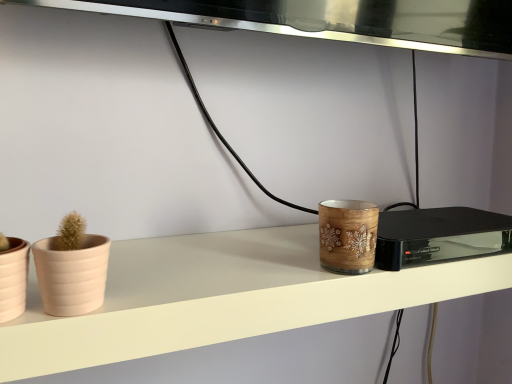
This screenshot has width=512, height=384. I want to click on free space behind wooden candle holder at center, so click(287, 245).